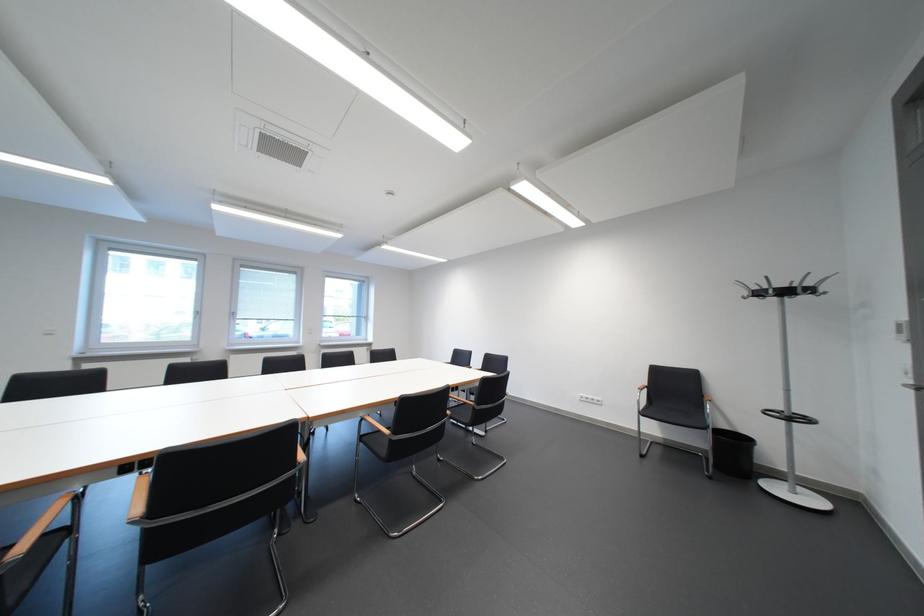
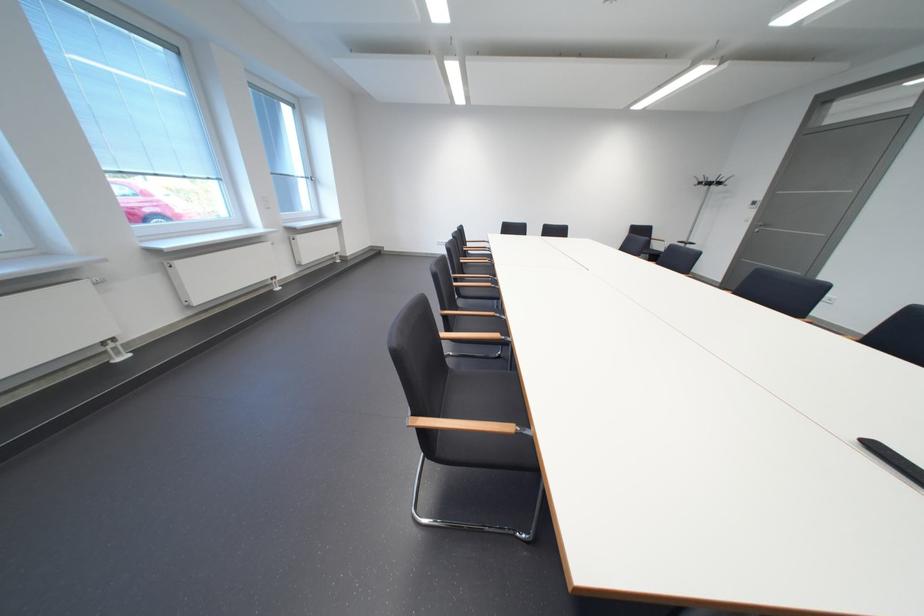
Question: I am providing you with two images of the same scene from different viewpoints. After the viewpoint changes to image2, which objects are now occluded?

Choices:
 (A) wooden chair armrest
 (B) black trash can
 (C) silver door handle
 (D) black equipment knob

Answer: (B)